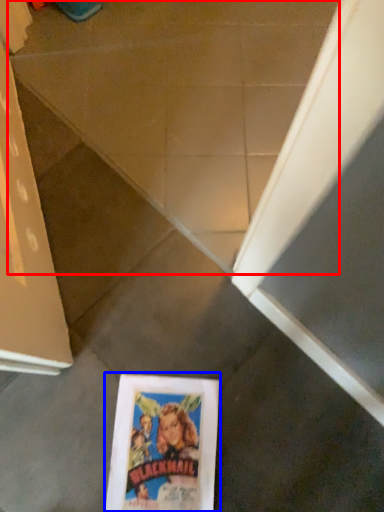
Question: Which point is further to the camera, concrete (highlighted by a red box) or paperback book (highlighted by a blue box)?

Choices:
 (A) concrete
 (B) paperback book

Answer: (A)